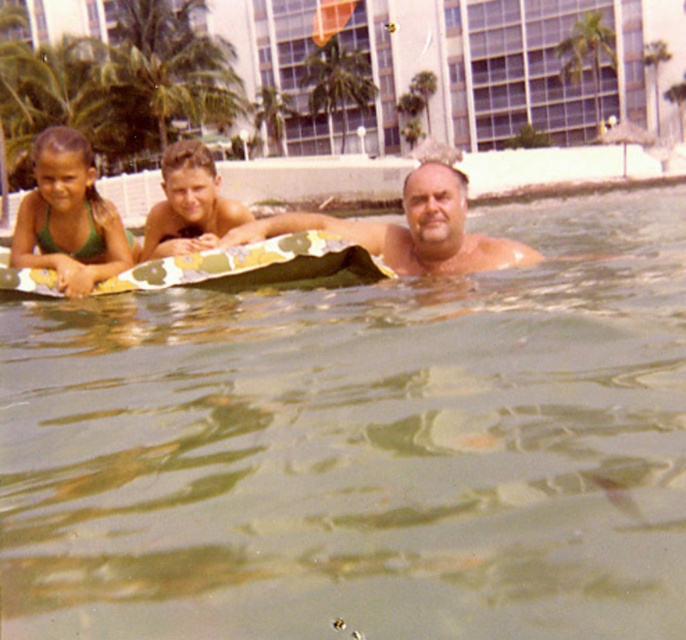
You are planning to jump into the pool. You see the greenish murky water at center and the green fabric float at upper left. Which one is wider from your perspective?

The greenish murky water at center is wider than the green fabric float at upper left.

You are a photographer trying to capture a closeup shot of the green fabric swimsuit at upper left and the camouflage fabric surfboard at upper center. Since you want to focus on the swimsuit, which object should you position closer to the camera?

The green fabric swimsuit at upper left is much taller than the camouflage fabric surfboard at upper center. To focus on the swimsuit, position the green fabric swimsuit at upper left closer to the camera so it appears larger in the frame.

You are a photographer trying to capture a clear shot of the green fabric swimsuit at upper left. Since the green fabric float at upper left is blocking your view, can you determine if moving slightly to the right would allow you to see the swimsuit without the float obscuring it?

The green fabric float at upper left is positioned under the green fabric swimsuit at upper left, so moving to the right might not help as the float is below the swimsuit. Adjusting your angle upwards could provide a clearer view without obstruction.